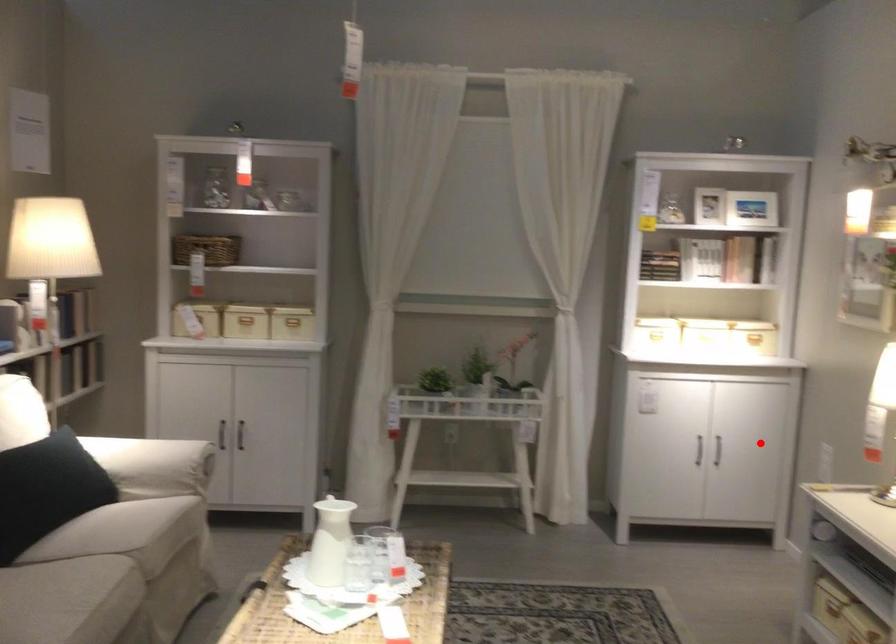
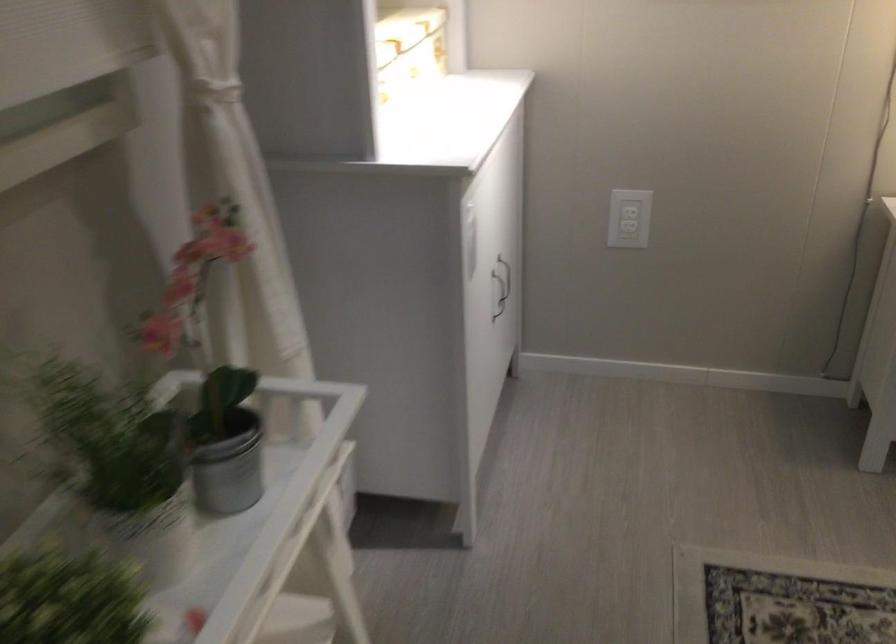
Question: A red point is marked in image1. In image2, is the corresponding 3D point closer to the camera or farther? Reply with the corresponding letter.

Choices:
 (A) The corresponding 3D point is closer.
 (B) The corresponding 3D point is farther.

Answer: (A)